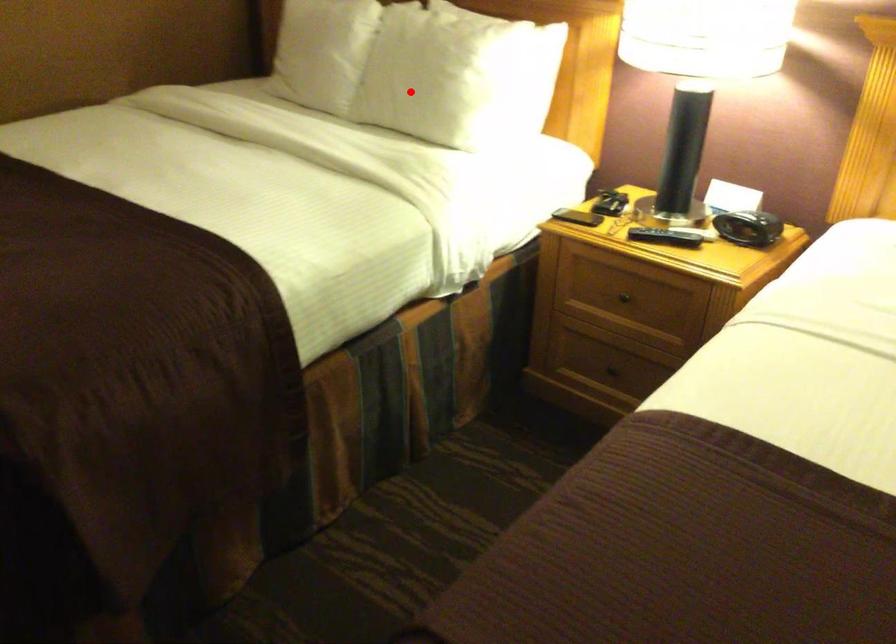
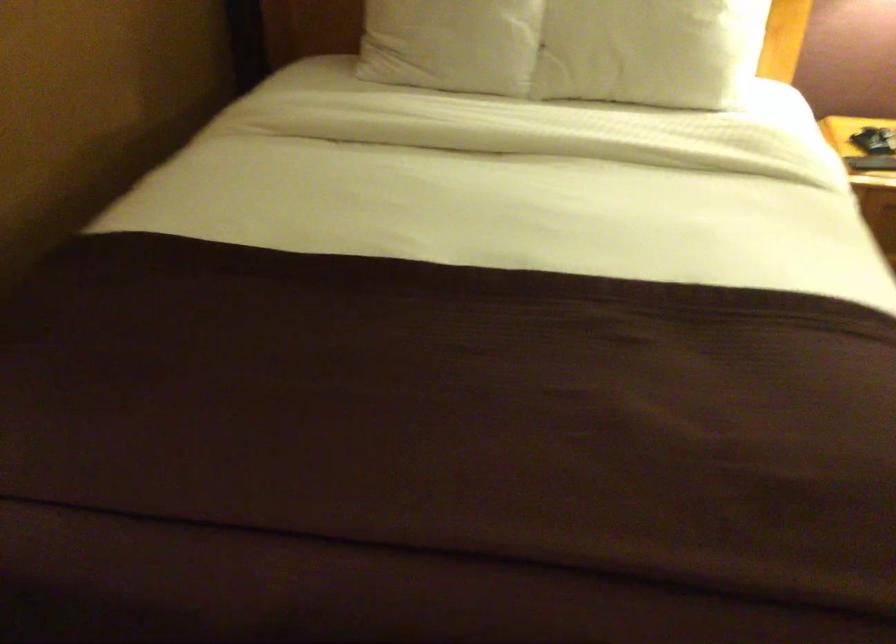
Locate, in the second image, the point that corresponds to the highlighted location in the first image.

(649, 51)